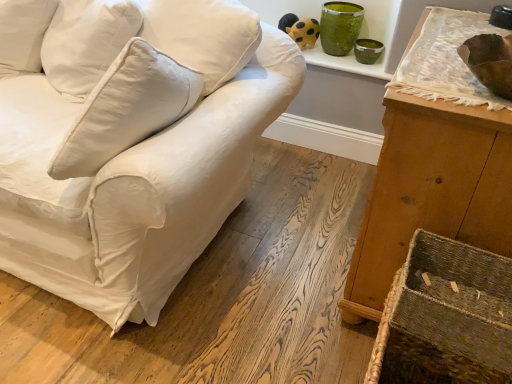
Question: Does yellow matte plush toy at upper center have a greater height compared to rustic woven basket at lower right?

Choices:
 (A) no
 (B) yes

Answer: (B)

Question: Is yellow matte plush toy at upper center turned away from rustic woven basket at lower right?

Choices:
 (A) yes
 (B) no

Answer: (B)

Question: Does yellow matte plush toy at upper center lie in front of rustic woven basket at lower right?

Choices:
 (A) yes
 (B) no

Answer: (B)

Question: Is yellow matte plush toy at upper center oriented towards rustic woven basket at lower right?

Choices:
 (A) yes
 (B) no

Answer: (B)

Question: Considering the relative sizes of yellow matte plush toy at upper center and rustic woven basket at lower right in the image provided, is yellow matte plush toy at upper center shorter than rustic woven basket at lower right?

Choices:
 (A) no
 (B) yes

Answer: (A)

Question: Is yellow matte plush toy at upper center bigger than rustic woven basket at lower right?

Choices:
 (A) no
 (B) yes

Answer: (A)

Question: Could you tell me if yellow matte plush toy at upper center is facing white cotton couch at center?

Choices:
 (A) no
 (B) yes

Answer: (B)

Question: From the image's perspective, is yellow matte plush toy at upper center on white cotton couch at center?

Choices:
 (A) yes
 (B) no

Answer: (A)

Question: Can white cotton couch at center be found inside yellow matte plush toy at upper center?

Choices:
 (A) yes
 (B) no

Answer: (B)

Question: Is yellow matte plush toy at upper center directly adjacent to white cotton couch at center?

Choices:
 (A) yes
 (B) no

Answer: (B)

Question: From a real-world perspective, is yellow matte plush toy at upper center below white cotton couch at center?

Choices:
 (A) yes
 (B) no

Answer: (B)

Question: Does yellow matte plush toy at upper center have a greater height compared to white cotton couch at center?

Choices:
 (A) no
 (B) yes

Answer: (A)

Question: Is white cotton couch at center wider than wooden cabinet at right?

Choices:
 (A) yes
 (B) no

Answer: (A)